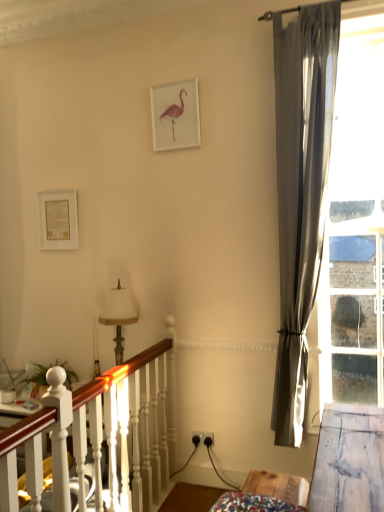
Question: Could clear glass window at right be considered to be inside white fabric lampshade at center-left?

Choices:
 (A) yes
 (B) no

Answer: (B)

Question: Is white fabric lampshade at center-left positioned before clear glass window at right?

Choices:
 (A) yes
 (B) no

Answer: (B)

Question: From a real-world perspective, is white fabric lampshade at center-left positioned over clear glass window at right based on gravity?

Choices:
 (A) yes
 (B) no

Answer: (B)

Question: Is white fabric lampshade at center-left oriented towards clear glass window at right?

Choices:
 (A) no
 (B) yes

Answer: (A)

Question: From the image's perspective, is white fabric lampshade at center-left under clear glass window at right?

Choices:
 (A) no
 (B) yes

Answer: (B)

Question: From the image's perspective, relative to white wooden bed frame at lower left, is white fabric lampshade at center-left above or below?

Choices:
 (A) above
 (B) below

Answer: (A)

Question: Which is correct: white fabric lampshade at center-left is inside white wooden bed frame at lower left, or outside of it?

Choices:
 (A) outside
 (B) inside

Answer: (A)

Question: Based on their positions, is white fabric lampshade at center-left located to the left or right of white wooden bed frame at lower left?

Choices:
 (A) right
 (B) left

Answer: (B)

Question: Is white fabric lampshade at center-left taller or shorter than white wooden bed frame at lower left?

Choices:
 (A) tall
 (B) short

Answer: (B)

Question: Does point (170, 108) appear closer or farther from the camera than point (46, 412)?

Choices:
 (A) farther
 (B) closer

Answer: (A)

Question: Based on their positions, is white matte picture frame at upper center, which is counted as the first picture frame, starting from the right, located to the left or right of white wooden bed frame at lower left?

Choices:
 (A) right
 (B) left

Answer: (A)

Question: From their relative heights in the image, would you say white matte picture frame at upper center, the 2th picture frame in the left-to-right sequence, is taller or shorter than white wooden bed frame at lower left?

Choices:
 (A) tall
 (B) short

Answer: (B)

Question: Is white matte picture frame at upper center, which is counted as the first picture frame, starting from the right, bigger or smaller than white wooden bed frame at lower left?

Choices:
 (A) small
 (B) big

Answer: (A)

Question: In terms of size, does white wooden bed frame at lower left appear bigger or smaller than white fabric lampshade at center-left?

Choices:
 (A) small
 (B) big

Answer: (B)

Question: From the image's perspective, is white wooden bed frame at lower left located above or below white fabric lampshade at center-left?

Choices:
 (A) below
 (B) above

Answer: (A)